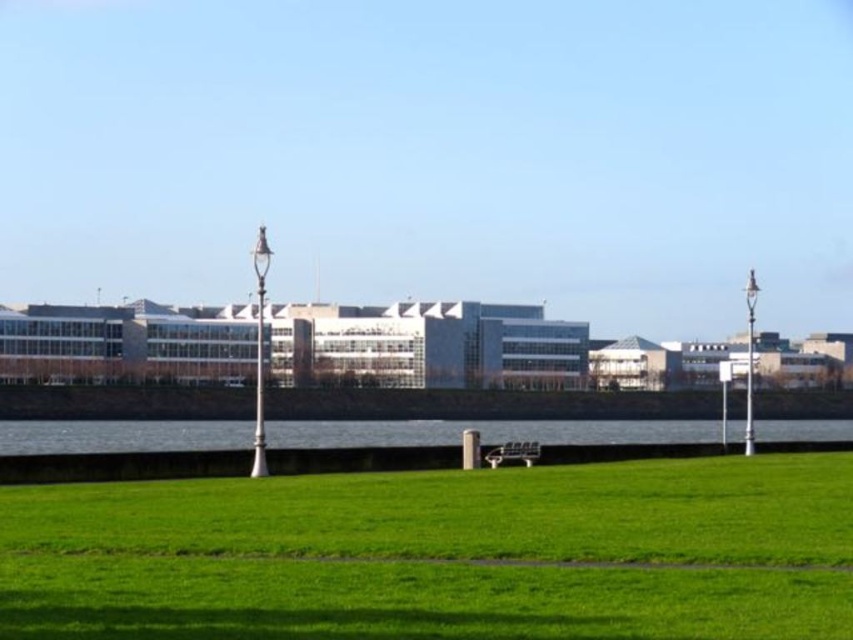
You are planning to place a picnic blanket on the green grassy field at lower center. The wooden park bench at center is nearby. Considering their sizes, which area has more space to spread out the blanket?

The green grassy field at lower center has a greater width than the wooden park bench at center, so it provides more space to spread out the picnic blanket.

You are standing at the start of the path between the two street lamps. You want to walk to the wooden park bench at center but need to cross the blue glass water at center first. Is the distance between them sufficient for you to walk directly from the path to the bench without needing to detour around the water?

The blue glass water at center is 92.50 meters away from the wooden park bench at center. Since the distance is quite large, you would need to detour around the water as walking directly across such a long stretch of water isn

You are standing at the point marked as point (439, 554) in the image. Looking around, you see a paved path running horizontally across the lower part of the frame and two ornate street lamps symmetrically placed on either side of the path. Which direction should you walk to reach the nearest ornate street lamp?

Since point (439, 554) is located on the green grassy field at lower center, you should walk towards either the left or right direction to reach the nearest ornate street lamp, as they are symmetrically placed on both sides of the paved path.